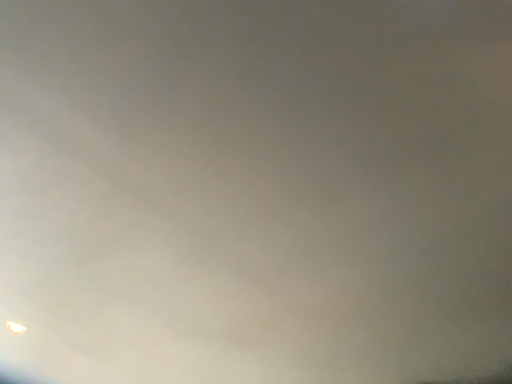
In order to face matte white street light at lower left, should I rotate leftwards or rightwards?

To align with it, rotate left about 29.388°.

Where is `matte white street light at lower left`? Image resolution: width=512 pixels, height=384 pixels. matte white street light at lower left is located at coordinates (15, 327).

What do you see at coordinates (15, 327) in the screenshot? I see `matte white street light at lower left` at bounding box center [15, 327].

You are a GUI agent. You are given a task and a screenshot of the screen. Output one action in this format:
    pyautogui.click(x=<x>, y=<y>)
    Task: Click on the matte white street light at lower left
    The width and height of the screenshot is (512, 384).
    Given the screenshot: What is the action you would take?
    click(x=15, y=327)